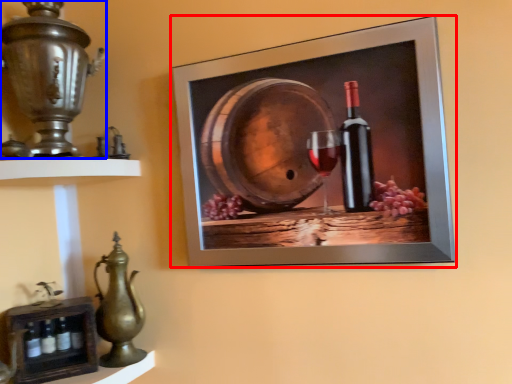
Question: Which point is further to the camera, picture frame (highlighted by a red box) or candle holder (highlighted by a blue box)?

Choices:
 (A) picture frame
 (B) candle holder

Answer: (A)